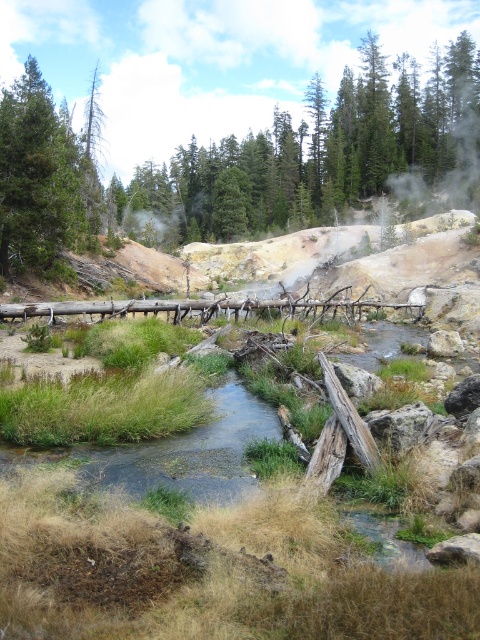
You are an environmental scientist studying the elevation changes in this landscape. You observe the green coniferous trees at upper center and the green matte tree at upper left. Which tree is at a higher elevation?

The green coniferous trees at upper center are located above the green matte tree at upper left, so they are at a higher elevation.

You are an artist sketching this landscape and want to draw the green matte tree at upper left and green coniferous trees at upper center. Which one should you draw first to follow the proper layering technique?

You should draw the green coniferous trees at upper center first because the green matte tree at upper left is behind them, so it needs to be layered over the top.

You are an environmental scientist examining the image. You notice two trees in the upper part of the scene. Which tree is located to the right of the other? The options are the green coniferous trees at upper center and the green matte tree at upper left.

The green coniferous trees at upper center is positioned on the right side of the green matte tree at upper left, so the green coniferous trees at upper center is to the right of the green matte tree at upper left.